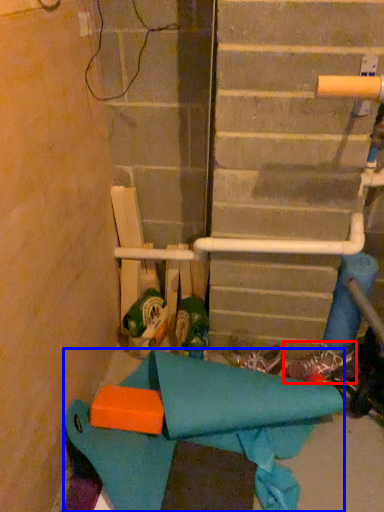
Question: Which object appears closest to the camera in this image, footwear (highlighted by a red box) or fabric (highlighted by a blue box)?

Choices:
 (A) footwear
 (B) fabric

Answer: (B)